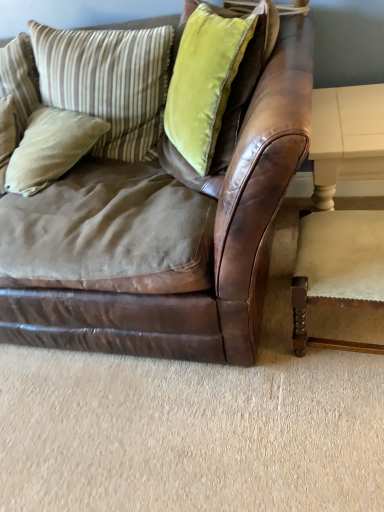
This screenshot has height=512, width=384. I want to click on vacant region to the left of beige fabric chair at lower right, so click(x=266, y=361).